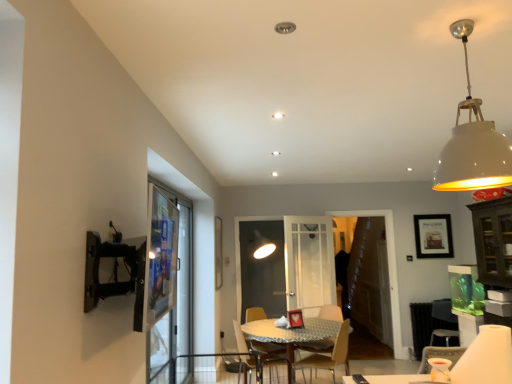
Where is `vacant region above white matte lampshade at upper right (from a real-world perspective)`? vacant region above white matte lampshade at upper right (from a real-world perspective) is located at coordinates (453, 19).